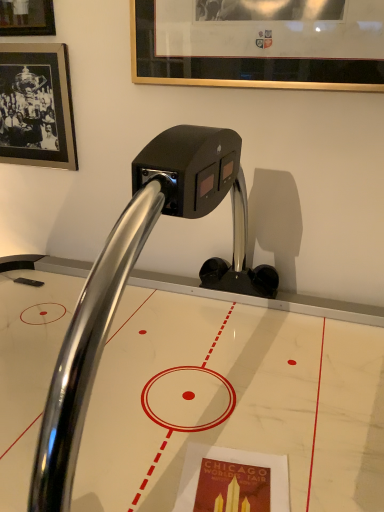
Question: Can you confirm if black matte picture frame at upper left, which is the 2th picture frame in front-to-back order, is shorter than polished chrome faucet at center?

Choices:
 (A) yes
 (B) no

Answer: (A)

Question: From the image's perspective, is black matte picture frame at upper left, which is the 2th picture frame in front-to-back order, on polished chrome faucet at center?

Choices:
 (A) yes
 (B) no

Answer: (A)

Question: From a real-world perspective, is black matte picture frame at upper left, which is the 2th picture frame in front-to-back order, positioned over polished chrome faucet at center based on gravity?

Choices:
 (A) yes
 (B) no

Answer: (A)

Question: Is black matte picture frame at upper left, which is the 2th picture frame in front-to-back order, directly adjacent to polished chrome faucet at center?

Choices:
 (A) yes
 (B) no

Answer: (B)

Question: From the image's perspective, is black matte picture frame at upper left, which is the 2th picture frame in front-to-back order, beneath polished chrome faucet at center?

Choices:
 (A) no
 (B) yes

Answer: (A)

Question: Is black matte picture frame at upper left, which is the 2th picture frame in front-to-back order, taller than polished chrome faucet at center?

Choices:
 (A) no
 (B) yes

Answer: (A)

Question: From the image's perspective, is polished chrome faucet at center on top of black matte picture frame at upper left, which is the 2th picture frame in front-to-back order?

Choices:
 (A) no
 (B) yes

Answer: (A)

Question: Is polished chrome faucet at center beside black matte picture frame at upper left, acting as the 2th picture frame starting from the right?

Choices:
 (A) no
 (B) yes

Answer: (A)

Question: Is the depth of polished chrome faucet at center less than that of black matte picture frame at upper left, which is the 2th picture frame in front-to-back order?

Choices:
 (A) yes
 (B) no

Answer: (A)

Question: Does polished chrome faucet at center have a lesser width compared to black matte picture frame at upper left, the first picture frame viewed from the back?

Choices:
 (A) yes
 (B) no

Answer: (B)

Question: Does polished chrome faucet at center appear on the left side of black matte picture frame at upper left, acting as the 2th picture frame starting from the right?

Choices:
 (A) no
 (B) yes

Answer: (A)

Question: From a real-world perspective, does polished chrome faucet at center sit lower than black matte picture frame at upper left, which is the 2th picture frame in front-to-back order?

Choices:
 (A) no
 (B) yes

Answer: (B)

Question: Is gold-framed picture at upper center, arranged as the 2th picture frame when viewed from the back, facing away from polished chrome faucet at center?

Choices:
 (A) yes
 (B) no

Answer: (B)